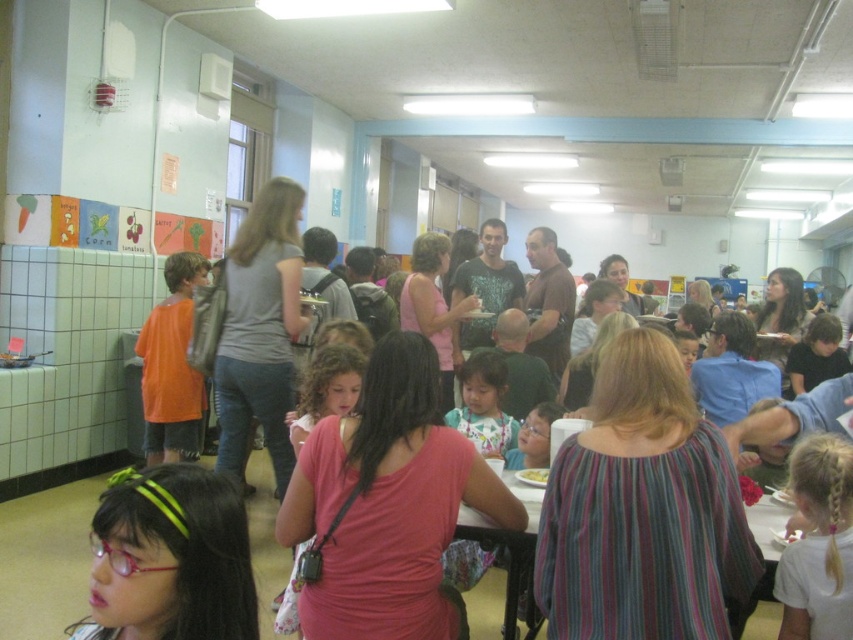
Question: Is white cotton shirt at lower right positioned at the back of white fabric table at lower right?

Choices:
 (A) no
 (B) yes

Answer: (A)

Question: Is white cotton shirt at lower right behind matte pink shirt at center?

Choices:
 (A) no
 (B) yes

Answer: (A)

Question: Which object appears closest to the camera in this image?

Choices:
 (A) pink fabric headband at lower left
 (B) brown matte shirt at center

Answer: (A)

Question: Which is farther from the light brown hair at center?

Choices:
 (A) white cotton shirt at lower right
 (B) white matte plate at center

Answer: (A)

Question: Considering the relative positions of white fabric table at lower right and curly hair at center in the image provided, where is white fabric table at lower right located with respect to curly hair at center?

Choices:
 (A) above
 (B) below

Answer: (B)

Question: Which object is positioned farthest from the dark green t-shirt at center?

Choices:
 (A) curly hair at center
 (B) white cotton shirt at lower right
 (C) brown matte shirt at center
 (D) orange matte shirt at left

Answer: (B)